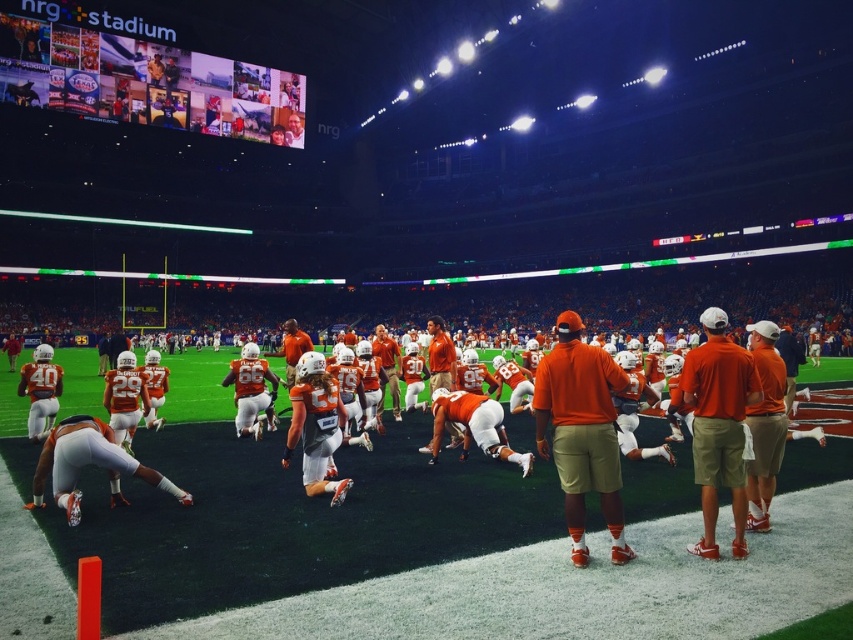
Consider the image. Does orange cotton shirt at center have a smaller size compared to orange fabric shirt at center?

Yes.

Looking at this image, does orange cotton shirt at center have a larger size compared to orange fabric shirt at center?

Actually, orange cotton shirt at center might be smaller than orange fabric shirt at center.

Between point (596, 452) and point (741, 442), which one is positioned in front?

Point (596, 452) is more forward.

I want to click on orange cotton shirt at center, so [581, 432].

Describe the element at coordinates (309, 509) in the screenshot. I see `orange matte uniform at center` at that location.

I want to click on orange matte uniform at center, so click(309, 509).

At what (x,y) coordinates should I click in order to perform the action: click on orange matte uniform at center. Please return your answer as a coordinate pair (x, y). This screenshot has height=640, width=853. Looking at the image, I should click on point(309,509).

Does point (184, 544) lie behind point (701, 442)?

That is True.

Locate an element on the screen. This screenshot has height=640, width=853. orange matte uniform at center is located at coordinates (309, 509).

You are a GUI agent. You are given a task and a screenshot of the screen. Output one action in this format:
    pyautogui.click(x=<x>, y=<y>)
    Task: Click on the orange matte uniform at center
    This screenshot has height=640, width=853.
    Given the screenshot: What is the action you would take?
    pyautogui.click(x=309, y=509)